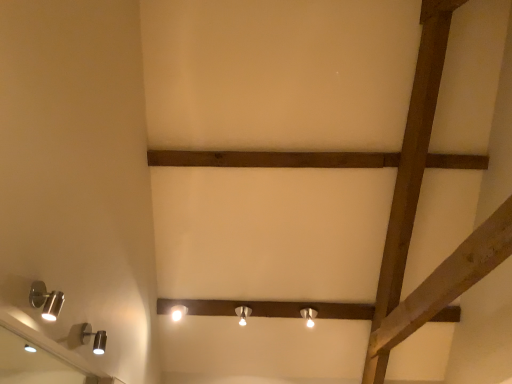
Question: Does white glossy lamp at center, which appears as the third lamp when ordered from the bottom, have a lesser width compared to matte silver lamp at center, placed as the 5th lamp when sorted from top to bottom?

Choices:
 (A) no
 (B) yes

Answer: (A)

Question: Does white glossy lamp at center, which is the 3th lamp in left-to-right order, have a greater width compared to matte silver lamp at center, which is the fifth lamp in left-to-right order?

Choices:
 (A) no
 (B) yes

Answer: (B)

Question: Is white glossy lamp at center, which appears as the third lamp when ordered from the bottom, at the left side of matte silver lamp at center, the 3th lamp positioned from the back?

Choices:
 (A) yes
 (B) no

Answer: (A)

Question: From the image's perspective, is white glossy lamp at center, acting as the fourth lamp starting from the front, on matte silver lamp at center, placed as the 5th lamp when sorted from top to bottom?

Choices:
 (A) yes
 (B) no

Answer: (A)

Question: Does white glossy lamp at center, the second lamp positioned from the back, have a larger size compared to matte silver lamp at center, which is counted as the first lamp, starting from the bottom?

Choices:
 (A) yes
 (B) no

Answer: (A)

Question: From a real-world perspective, is satin silver spotlight at lower left, marked as the first lamp in a front-to-back arrangement, positioned above or below satin silver spotlight at lower left, arranged as the fourth lamp when ordered from the bottom?

Choices:
 (A) above
 (B) below

Answer: (B)

Question: From the image's perspective, relative to satin silver spotlight at lower left, the second lamp when ordered from front to back, is satin silver spotlight at lower left, the 5th lamp positioned from the back, above or below?

Choices:
 (A) below
 (B) above

Answer: (B)

Question: Considering the positions of satin silver spotlight at lower left, marked as the 5th lamp in a bottom-to-top arrangement, and satin silver spotlight at lower left, the fourth lamp when ordered from right to left, in the image, is satin silver spotlight at lower left, marked as the 5th lamp in a bottom-to-top arrangement, taller or shorter than satin silver spotlight at lower left, the fourth lamp when ordered from right to left,?

Choices:
 (A) short
 (B) tall

Answer: (B)

Question: Is satin silver spotlight at lower left, marked as the 5th lamp in a bottom-to-top arrangement, in front of or behind satin silver spotlight at lower left, the fourth lamp when ordered from right to left, in the image?

Choices:
 (A) behind
 (B) front

Answer: (B)

Question: Considering the positions of silver metallic mirror at lower left and matte silver lamp at center, which appears as the fourth lamp when viewed from the top, in the image, is silver metallic mirror at lower left taller or shorter than matte silver lamp at center, which appears as the fourth lamp when viewed from the top,?

Choices:
 (A) tall
 (B) short

Answer: (A)

Question: Do you think silver metallic mirror at lower left is within matte silver lamp at center, which is the second lamp in right-to-left order, or outside of it?

Choices:
 (A) outside
 (B) inside

Answer: (A)

Question: Looking at the image, does silver metallic mirror at lower left seem bigger or smaller compared to matte silver lamp at center, marked as the 5th lamp in a front-to-back arrangement?

Choices:
 (A) small
 (B) big

Answer: (B)

Question: In terms of width, does silver metallic mirror at lower left look wider or thinner when compared to matte silver lamp at center, the 1th lamp viewed from the back?

Choices:
 (A) wide
 (B) thin

Answer: (B)

Question: Is brown wooden plank at center spatially inside matte silver lamp at center, the 1th lamp viewed from the back, or outside of it?

Choices:
 (A) outside
 (B) inside

Answer: (A)

Question: Looking at the image, does brown wooden plank at center seem bigger or smaller compared to matte silver lamp at center, which is counted as the second lamp, starting from the bottom?

Choices:
 (A) small
 (B) big

Answer: (B)